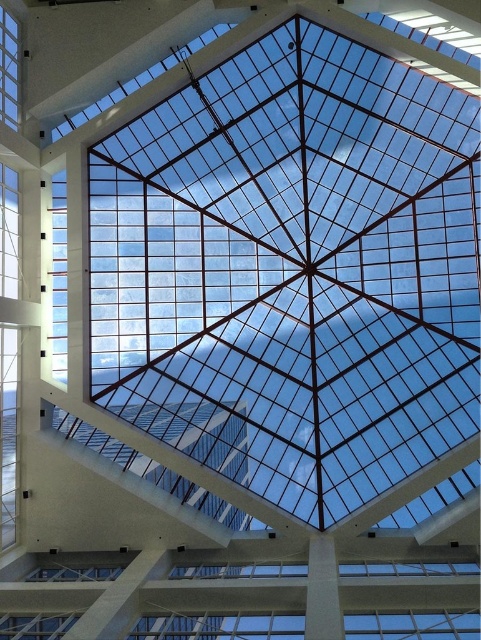
Question: Among these points, which one is nearest to the camera?

Choices:
 (A) (55, 250)
 (B) (88, 108)
 (C) (5, 109)

Answer: (C)

Question: Is the position of clear glass window at left more distant than that of transparent glass window at upper left?

Choices:
 (A) yes
 (B) no

Answer: (A)

Question: Which object is positioned farthest from the transparent glass window at upper left?

Choices:
 (A) clear glass window at left
 (B) transparent glass window at upper center

Answer: (A)

Question: Which point is farther to the camera?

Choices:
 (A) clear glass window at left
 (B) transparent glass window at upper left

Answer: (A)

Question: From the image, what is the correct spatial relationship of clear glass window at left in relation to transparent glass window at upper left?

Choices:
 (A) above
 (B) below

Answer: (B)

Question: Where is clear glass window at left located in relation to transparent glass window at upper left in the image?

Choices:
 (A) right
 (B) left

Answer: (A)